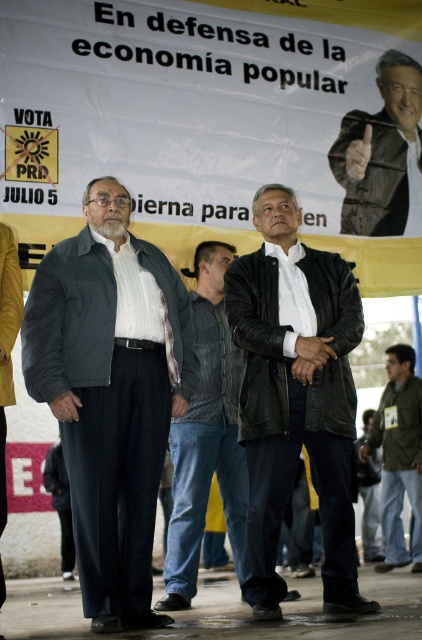
Question: Among these objects, which one is farthest from the camera?

Choices:
 (A) dark gray pants at lower left
 (B) black leather jacket at center
 (C) green matte jacket at lower right
 (D) leather jacket at center

Answer: (A)

Question: From the image, what is the correct spatial relationship of brown leather jacket at upper right in relation to green matte jacket at lower right?

Choices:
 (A) left
 (B) right

Answer: (A)

Question: Is dark gray jacket at center smaller than dark gray pants at lower left?

Choices:
 (A) no
 (B) yes

Answer: (A)

Question: Considering the real-world distances, which object is farthest from the dark gray jacket at center?

Choices:
 (A) green matte jacket at lower right
 (B) black leather jacket at center

Answer: (A)

Question: Can you confirm if black leather jacket at center is thinner than green matte jacket at lower right?

Choices:
 (A) yes
 (B) no

Answer: (B)

Question: Which point appears farthest from the camera in this image?

Choices:
 (A) (349, 209)
 (B) (411, 481)

Answer: (B)